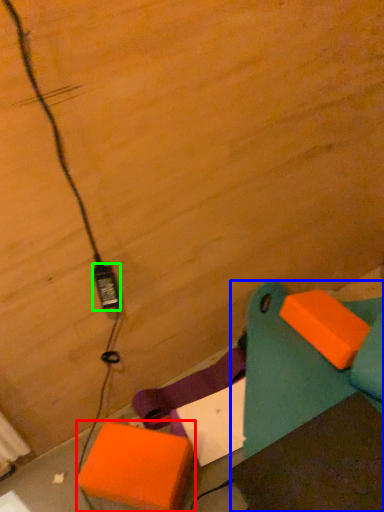
Question: Which is nearer to the cardboard box (highlighted by a red box)? furniture (highlighted by a blue box) or power plugs and sockets (highlighted by a green box).

Choices:
 (A) furniture
 (B) power plugs and sockets

Answer: (A)